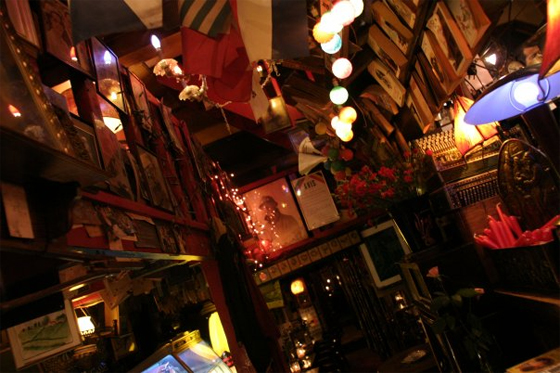
At what (x,y) coordinates should I click in order to perform the action: click on red candle. Please return your answer as a coordinate pair (x, y). Looking at the image, I should click on (496, 211).